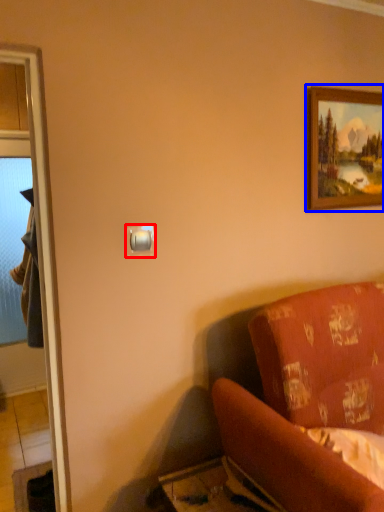
Question: Among these objects, which one is nearest to the camera, light switch (highlighted by a red box) or picture frame (highlighted by a blue box)?

Choices:
 (A) light switch
 (B) picture frame

Answer: (A)